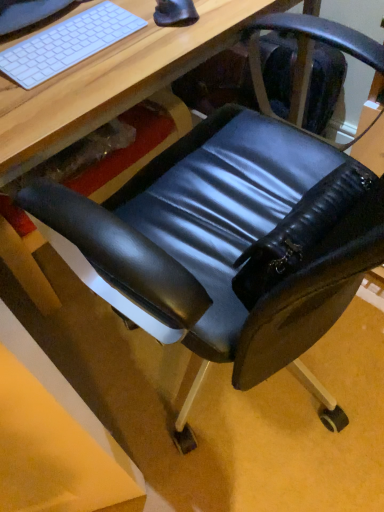
At what (x,y) coordinates should I click in order to perform the action: click on vacant space in front of black rubber mouse at upper center. Please return your answer as a coordinate pair (x, y). The width and height of the screenshot is (384, 512). Looking at the image, I should click on (157, 57).